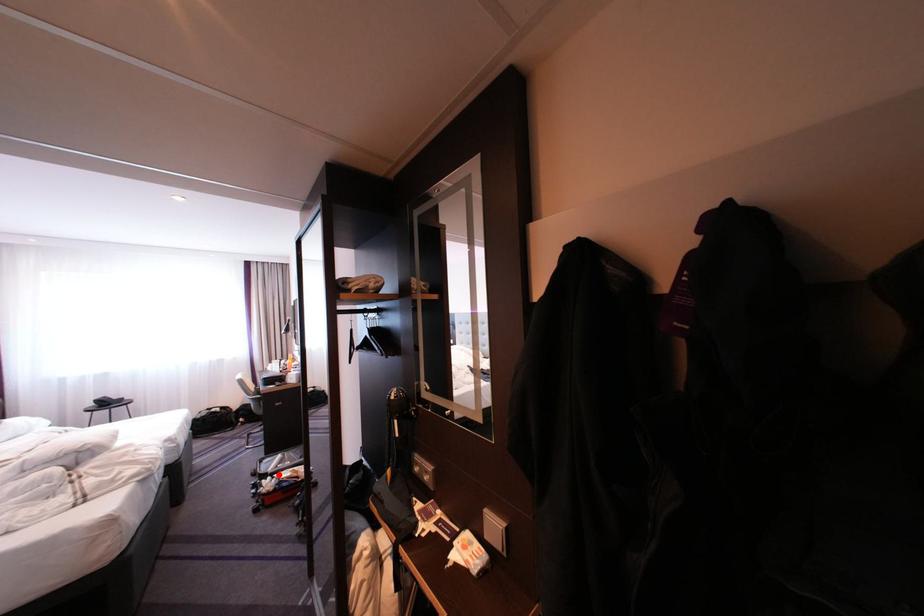
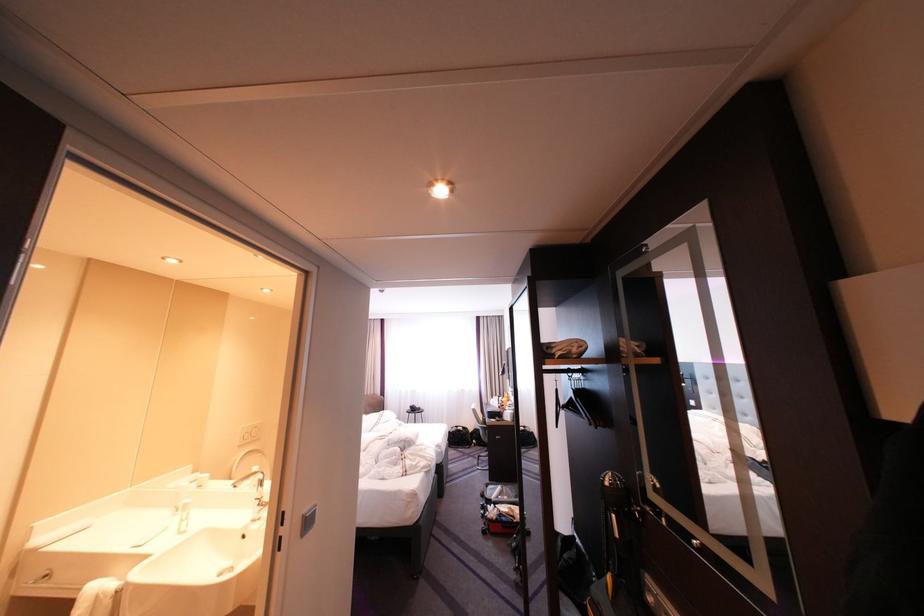
The point at the highlighted location is marked in the first image. Where is the corresponding point in the second image?

(503, 501)